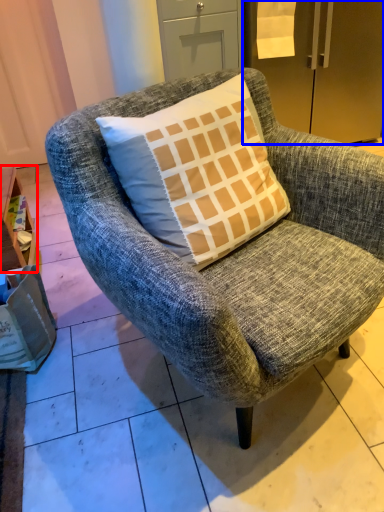
Question: Which object appears closest to the camera in this image, table (highlighted by a red box) or refrigerator (highlighted by a blue box)?

Choices:
 (A) table
 (B) refrigerator

Answer: (A)